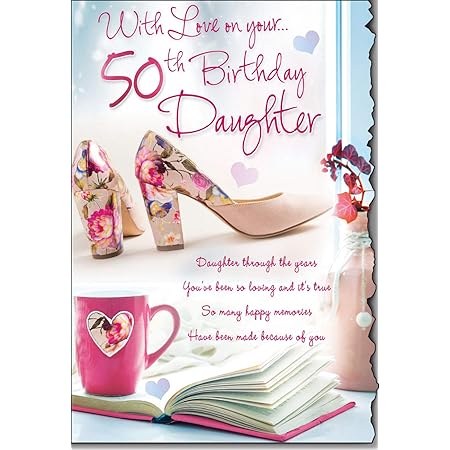
Identify the location of pink cup. This screenshot has width=450, height=450. (99, 382).